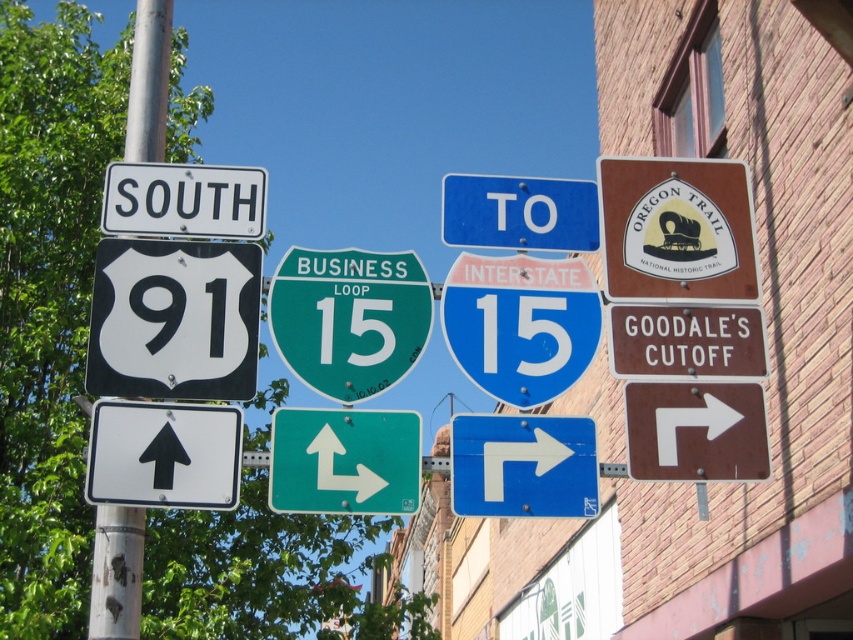
Question: Can you confirm if brown/metallic oregon trail sign at upper right is bigger than white plastic arrow at upper right?

Choices:
 (A) no
 (B) yes

Answer: (B)

Question: Estimate the real-world distances between objects in this image. Which object is closer to the brown/metallic oregon trail sign at upper right?

Choices:
 (A) metallic pole at left
 (B) blue glossy arrow at upper center
 (C) white plastic arrow at upper right
 (D) white plastic arrow at center

Answer: (C)

Question: Is blue glossy arrow at upper center to the left of blue plastic sign at upper center from the viewer's perspective?

Choices:
 (A) yes
 (B) no

Answer: (B)

Question: Estimate the real-world distances between objects in this image. Which object is closer to the blue glossy arrow at upper center?

Choices:
 (A) green glossy business loop 15 sign at center
 (B) green glossy sign at center
 (C) white plastic arrow at upper center

Answer: (C)

Question: Where is brown/metallic oregon trail sign at upper right located in relation to blue plastic sign at upper center in the image?

Choices:
 (A) above
 (B) below

Answer: (B)

Question: Among these points, which one is farthest from the camera?

Choices:
 (A) (703, 252)
 (B) (524, 435)
 (C) (450, 179)

Answer: (C)